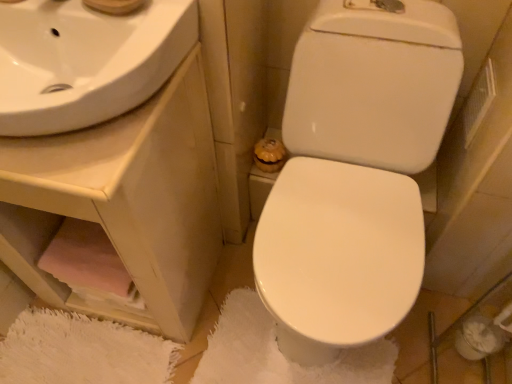
What do you see at coordinates (279, 352) in the screenshot? I see `white fluffy bath mat at center` at bounding box center [279, 352].

Identify the location of white glossy toilet at center. (355, 173).

The height and width of the screenshot is (384, 512). Find the location of `white glossy sink at upper left`. white glossy sink at upper left is located at coordinates (85, 61).

In order to click on white glossy sink at upper left in this screenshot , I will do `click(120, 209)`.

Image resolution: width=512 pixels, height=384 pixels. I want to click on pink fabric at lower left, so [x=89, y=264].

Which is nearer, (358, 358) or (0, 63)?

The point (0, 63) is more forward.

Is white fluffy bath mat at center with white glossy sink at upper left?

No, white fluffy bath mat at center is not making contact with white glossy sink at upper left.

Is white fluffy bath mat at center positioned before white glossy sink at upper left?

No, white fluffy bath mat at center is further to the viewer.

Considering the sizes of objects white fluffy bath mat at center and white glossy sink at upper left in the image provided, who is shorter, white fluffy bath mat at center or white glossy sink at upper left?

Standing shorter between the two is white fluffy bath mat at center.

Are white glossy sink at upper left and white fluffy bath mat at center making contact?

No, white glossy sink at upper left is not with white fluffy bath mat at center.

The width and height of the screenshot is (512, 384). Find the location of `bath mat below the white glossy sink at upper left (from the image's perspective)`. bath mat below the white glossy sink at upper left (from the image's perspective) is located at coordinates (279, 352).

From a real-world perspective, who is located higher, white glossy sink at upper left or white fluffy bath mat at center?

white glossy sink at upper left is physically above.

Is white glossy sink at upper left bigger than white fluffy bath mat at center?

Correct, white glossy sink at upper left is larger in size than white fluffy bath mat at center.

Considering the sizes of objects white glossy sink at upper left and white glossy sink at upper left in the image provided, who is taller, white glossy sink at upper left or white glossy sink at upper left?

white glossy sink at upper left is taller.

Between white glossy sink at upper left and white glossy sink at upper left, which one has larger size?

Bigger between the two is white glossy sink at upper left.

The width and height of the screenshot is (512, 384). Find the location of `counter top that is behind the white glossy sink at upper left`. counter top that is behind the white glossy sink at upper left is located at coordinates (120, 209).

Does white glossy sink at upper left turn towards white glossy sink at upper left?

No.

Considering the relative sizes of white glossy toilet at center and white fluffy bath mat at center in the image provided, is white glossy toilet at center taller than white fluffy bath mat at center?

Yes, white glossy toilet at center is taller than white fluffy bath mat at center.

From a real-world perspective, is white glossy toilet at center located higher than white fluffy bath mat at center?

Yes, from a real-world perspective, white glossy toilet at center is above white fluffy bath mat at center.

What are the coordinates of `toilet paper in front of the white fluffy bath mat at center` in the screenshot? It's located at (89, 264).

Considering the sizes of objects pink fabric at lower left and white fluffy bath mat at center in the image provided, who is thinner, pink fabric at lower left or white fluffy bath mat at center?

Thinner between the two is pink fabric at lower left.

Looking at this image, is pink fabric at lower left surrounding white fluffy bath mat at center?

No, white fluffy bath mat at center is not surrounded by pink fabric at lower left.

Is white glossy sink at upper left spatially inside white fluffy bath mat at center, or outside of it?

white glossy sink at upper left cannot be found inside white fluffy bath mat at center.

Between white glossy sink at upper left and white fluffy bath mat at center, which one has less height?

white fluffy bath mat at center.

From the image's perspective, is white glossy sink at upper left on top of white fluffy bath mat at center?

Correct, white glossy sink at upper left appears higher than white fluffy bath mat at center in the image.

From a real-world perspective, which object rests below the other?

white fluffy bath mat at center is physically lower.

Is white fluffy bath mat at center bigger or smaller than white glossy sink at upper left?

white fluffy bath mat at center is smaller than white glossy sink at upper left.

Based on the photo, from the image's perspective, between white fluffy bath mat at center and white glossy sink at upper left, which one is located above?

white glossy sink at upper left.

Which is farther, (228, 348) or (49, 198)?

Positioned behind is point (228, 348).

I want to click on bath mat lying on the right of white glossy sink at upper left, so click(x=279, y=352).

In order to click on sink above the white fluffy bath mat at center (from the image's perspective) in this screenshot , I will do `click(85, 61)`.

Estimate the real-world distances between objects in this image. Which object is closer to white glossy sink at upper left, pink fabric at lower left or white fluffy bath mat at center?

The object closer to white glossy sink at upper left is pink fabric at lower left.

Looking at the image, which one is located further to white glossy sink at upper left, white glossy toilet at center or white glossy sink at upper left?

white glossy toilet at center is further to white glossy sink at upper left.

Based on their spatial positions, is white glossy sink at upper left or pink fabric at lower left closer to white glossy toilet at center?

white glossy sink at upper left.

Considering their positions, is pink fabric at lower left positioned closer to white glossy sink at upper left than white glossy toilet at center?

white glossy toilet at center.

Looking at the image, which one is located further to white fluffy bath mat at center, white glossy sink at upper left or white glossy toilet at center?

Based on the image, white glossy sink at upper left appears to be further to white fluffy bath mat at center.

Looking at the image, which one is located further to white glossy toilet at center, pink fabric at lower left or white fluffy bath mat at center?

pink fabric at lower left is positioned further to the anchor white glossy toilet at center.

From the image, which object appears to be farther from white glossy sink at upper left, white fluffy bath mat at center or pink fabric at lower left?

The object further to white glossy sink at upper left is white fluffy bath mat at center.

Looking at the image, which one is located further to white glossy sink at upper left, pink fabric at lower left or white fluffy bath mat at center?

The object further to white glossy sink at upper left is white fluffy bath mat at center.

In order to click on toilet between white glossy sink at upper left and white fluffy bath mat at center vertically in this screenshot , I will do `click(355, 173)`.

The image size is (512, 384). Find the location of `sink located between white glossy sink at upper left and white glossy toilet at center in the left-right direction`. sink located between white glossy sink at upper left and white glossy toilet at center in the left-right direction is located at coordinates (85, 61).

The image size is (512, 384). What are the coordinates of `counter top between white glossy sink at upper left and white fluffy bath mat at center from top to bottom` in the screenshot? It's located at (120, 209).

Where is `bath mat situated between pink fabric at lower left and white glossy toilet at center from left to right`? bath mat situated between pink fabric at lower left and white glossy toilet at center from left to right is located at coordinates (279, 352).